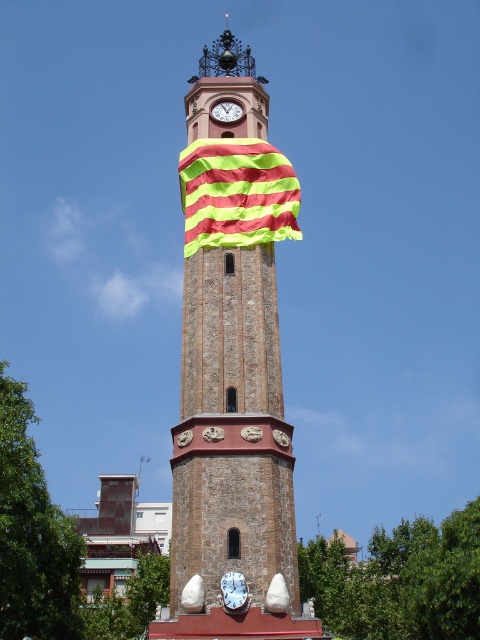
Question: Which point appears farthest from the camera in this image?

Choices:
 (A) (216, 140)
 (B) (240, 132)
 (C) (225, 598)

Answer: (B)

Question: Which is farther from the yellow-green striped cloth at center?

Choices:
 (A) white glossy clock at center
 (B) brown stone clock tower at center

Answer: (A)

Question: From the image, what is the correct spatial relationship of yellow-green striped cloth at center in relation to white glossy clock at center?

Choices:
 (A) left
 (B) right

Answer: (A)

Question: In this image, where is brown stone clock tower at center located relative to white glossy clock at center?

Choices:
 (A) right
 (B) left

Answer: (B)

Question: Is yellow-green striped cloth at center to the left of white glossy clock at center from the viewer's perspective?

Choices:
 (A) yes
 (B) no

Answer: (A)

Question: Which point is farther to the camera?

Choices:
 (A) (208, 196)
 (B) (229, 572)
 (C) (269, 461)

Answer: (A)